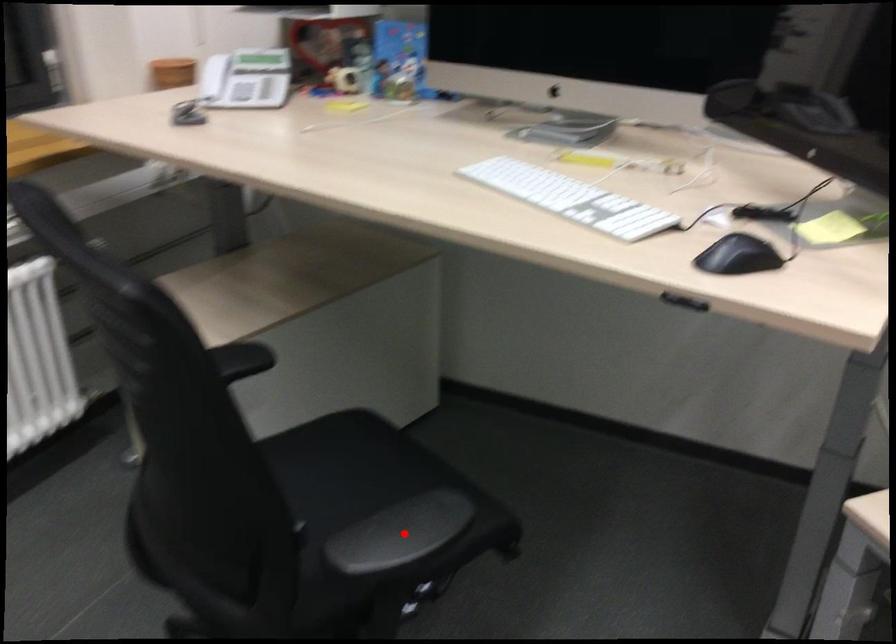
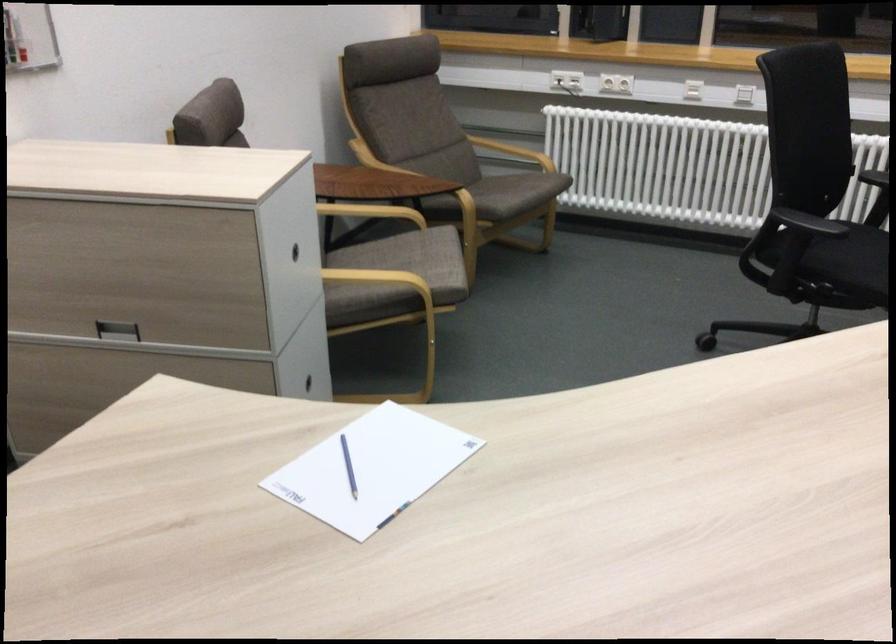
Question: I am providing you with two images of the same scene from different viewpoints. Given a red point in image1, look at the same physical point in image2. Is it:

Choices:
 (A) Closer to the viewpoint
 (B) Farther from the viewpoint

Answer: (B)